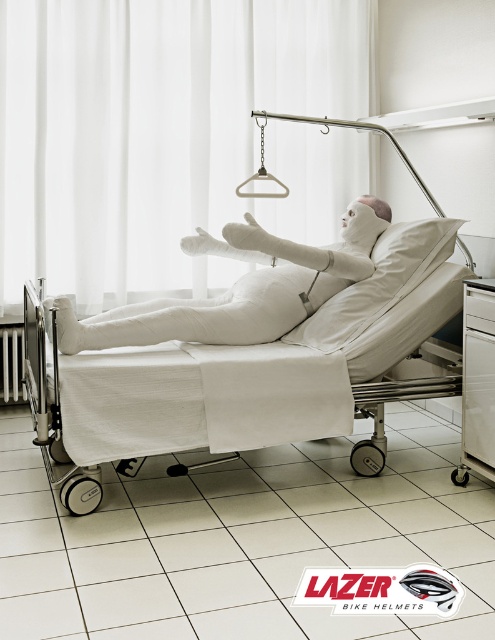
Question: Estimate the real-world distances between objects in this image. Which object is closer to the white bandaged figure at center?

Choices:
 (A) white fabric hospital bed at center
 (B) white plastic radiator at lower left

Answer: (A)

Question: Which object appears closest to the camera in this image?

Choices:
 (A) white plastic drawer at lower right
 (B) white plastic radiator at lower left
 (C) white bandaged figure at center
 (D) white fabric hospital bed at center

Answer: (D)

Question: Is white bandaged figure at center behind white plastic drawer at lower right?

Choices:
 (A) no
 (B) yes

Answer: (A)

Question: Which object is farther from the camera taking this photo?

Choices:
 (A) white fabric hospital bed at center
 (B) white plastic radiator at lower left
 (C) white bandaged figure at center
 (D) white plastic drawer at lower right

Answer: (B)

Question: Is white bandaged figure at center thinner than white plastic drawer at lower right?

Choices:
 (A) no
 (B) yes

Answer: (A)

Question: Is white bandaged figure at center positioned before white plastic radiator at lower left?

Choices:
 (A) yes
 (B) no

Answer: (A)